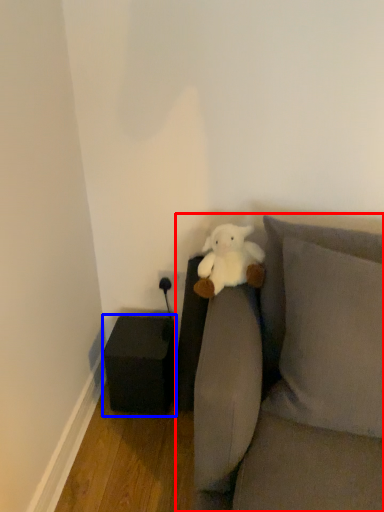
Question: Which point is further to the camera, studio couch (highlighted by a red box) or furniture (highlighted by a blue box)?

Choices:
 (A) studio couch
 (B) furniture

Answer: (B)